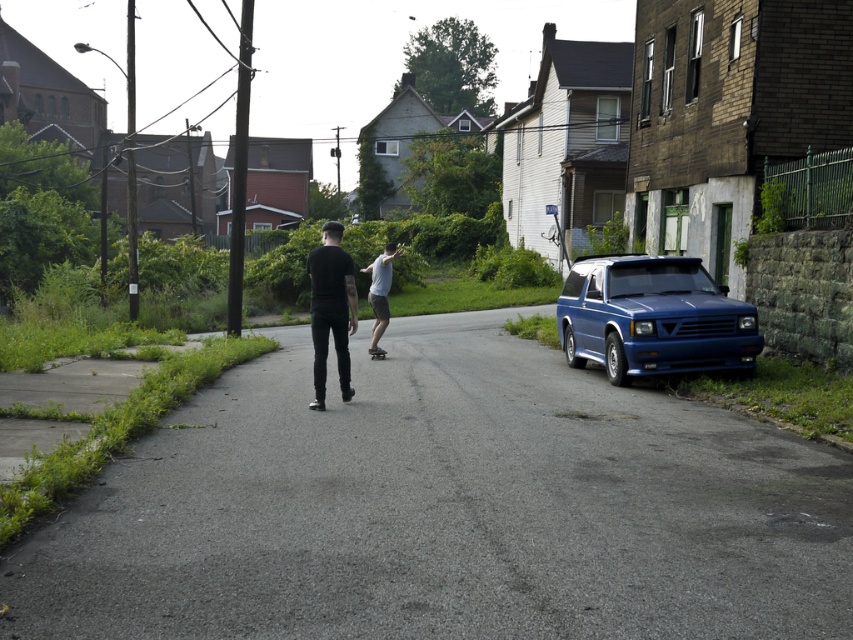
You are a pedestrian standing on the smooth asphalt road at center and want to cross to the blue metallic suv at right. Which direction should you walk to reach the suv without crossing the road?

The smooth asphalt road at center is positioned on the left side of the blue metallic suv at right. To reach the suv without crossing the road, you should walk to the right along the road until you are aligned with the suv and then proceed towards it.

You are a delivery person who needs to park your 2.5 meters tall delivery van. You see the blue metallic suv at right and the black matte pants at center. Which parking spot can you choose that is taller than your van?

The blue metallic suv at right is much taller than the black matte pants at center. Since your van is 2.5 meters tall, the parking spot for the blue metallic suv at right would accommodate your van as it is taller. The black matte pants at center is shorter, so it won not fit.